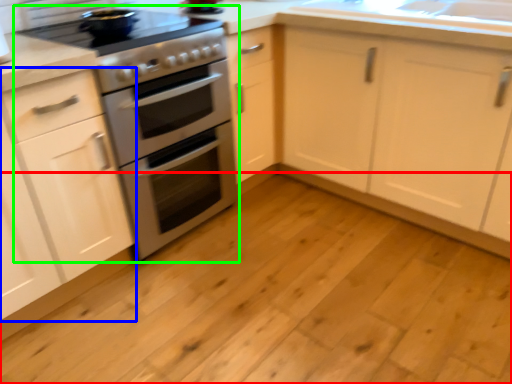
Question: Which is farther away from plain (highlighted by a red box)? cabinetry (highlighted by a blue box) or appliance (highlighted by a green box)?

Choices:
 (A) cabinetry
 (B) appliance

Answer: (A)